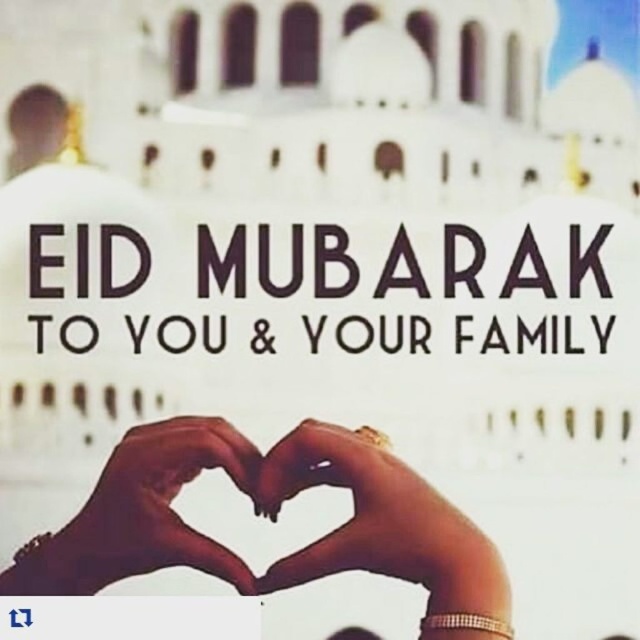
Between point (442, 624) and point (122, 477), which one is positioned behind?

Point (122, 477)

Does point (435, 524) come farther from viewer compared to point (186, 417)?

That is False.

You are a GUI agent. You are given a task and a screenshot of the screen. Output one action in this format:
    pyautogui.click(x=<x>, y=<y>)
    Task: Click on the gold metallic ring at center
    
    Given the screenshot: What is the action you would take?
    pyautogui.click(x=385, y=529)